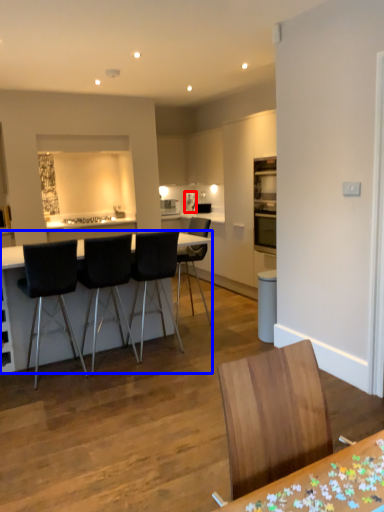
Question: Which object appears closest to the camera in this image, kitchen appliance (highlighted by a red box) or table (highlighted by a blue box)?

Choices:
 (A) kitchen appliance
 (B) table

Answer: (B)